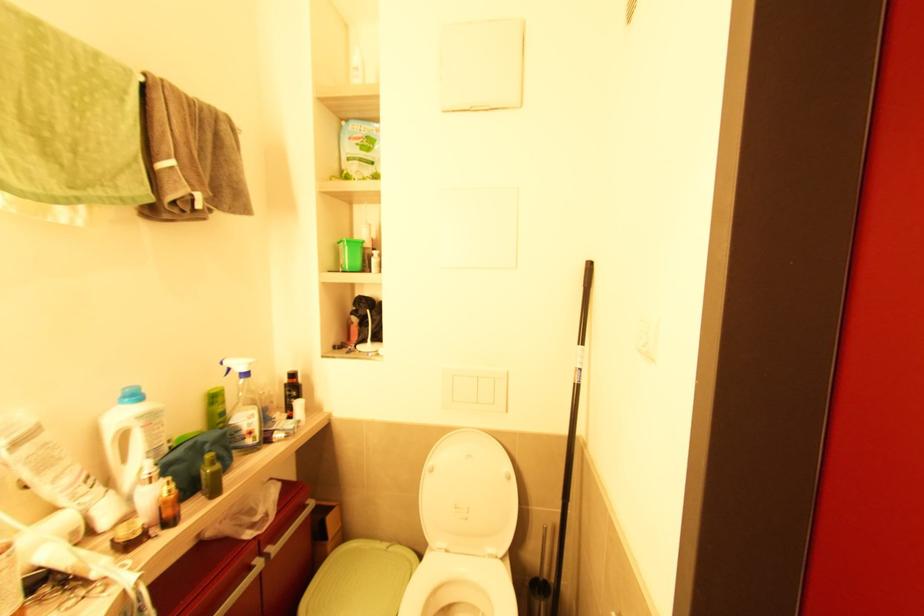
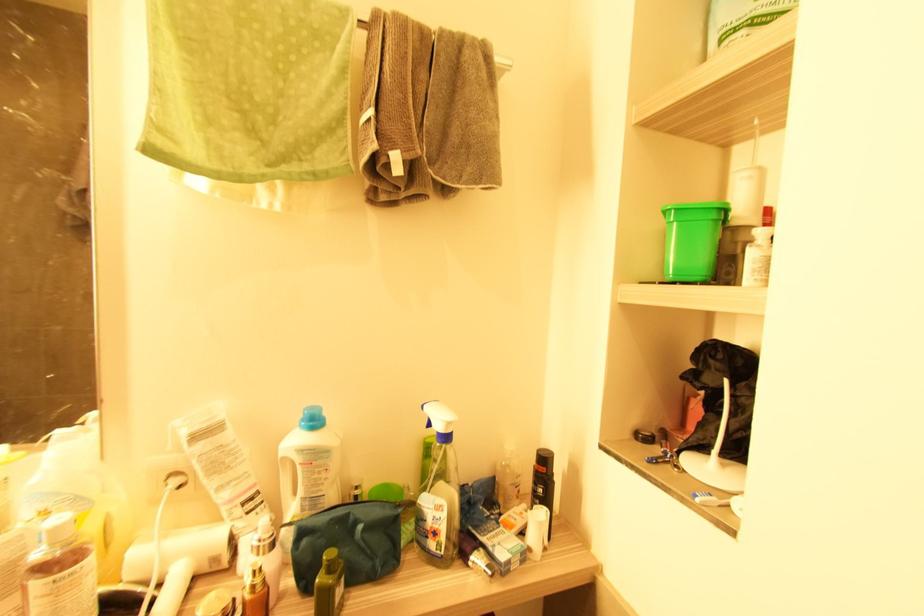
Locate, in the second image, the point that corresponds to (214,464) in the first image.

(331, 572)